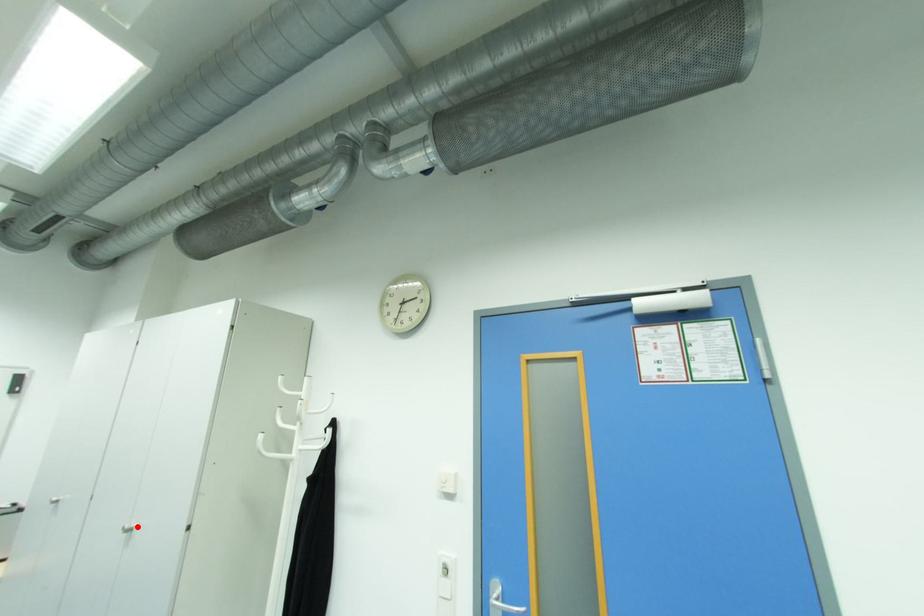
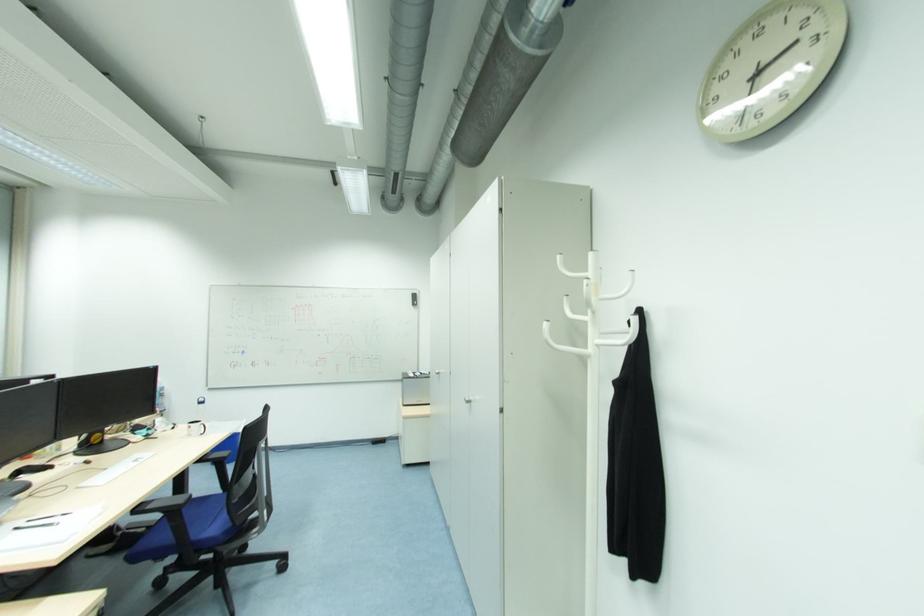
The point at the highlighted location is marked in the first image. Where is the corresponding point in the second image?

(473, 400)